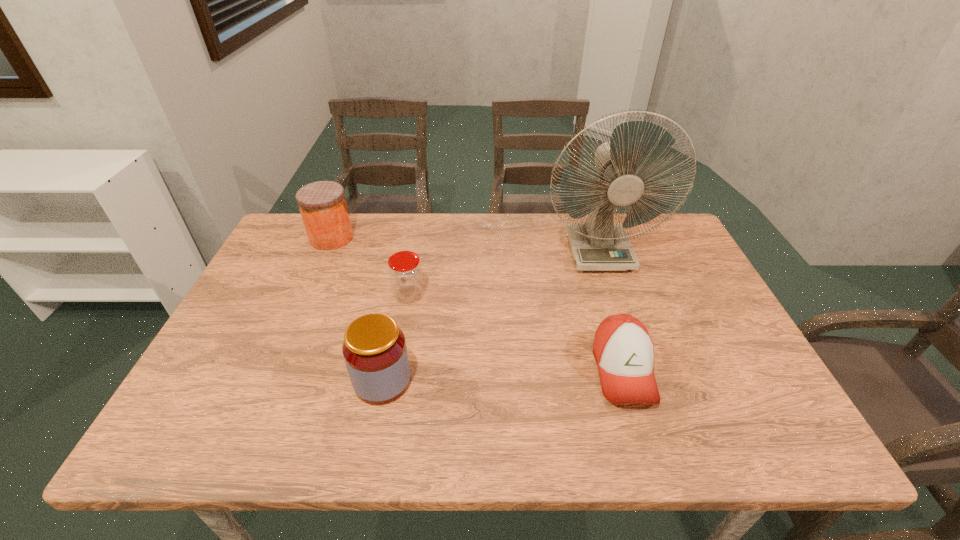
This screenshot has height=540, width=960. What are the coordinates of `the tallest object` in the screenshot? It's located at (598, 244).

The height and width of the screenshot is (540, 960). I want to click on the leftmost object, so click(x=323, y=207).

The height and width of the screenshot is (540, 960). What are the coordinates of `the leftmost jar` in the screenshot? It's located at (323, 207).

In order to click on the nearest jar in this screenshot , I will do `click(374, 349)`.

Where is `the shortest jar`? the shortest jar is located at coordinates (x=405, y=272).

Where is `the third nearest object`? The image size is (960, 540). the third nearest object is located at coordinates (405, 272).

I want to click on baseball cap, so click(624, 351).

Where is `free spot located 0.120m on the front-facing side of the tallest object`? free spot located 0.120m on the front-facing side of the tallest object is located at coordinates (617, 305).

The image size is (960, 540). I want to click on free space located on the front of the leftmost object, so click(x=309, y=289).

Identify the location of vacant space located 0.110m on the right of the nearest jar. This screenshot has height=540, width=960. (461, 381).